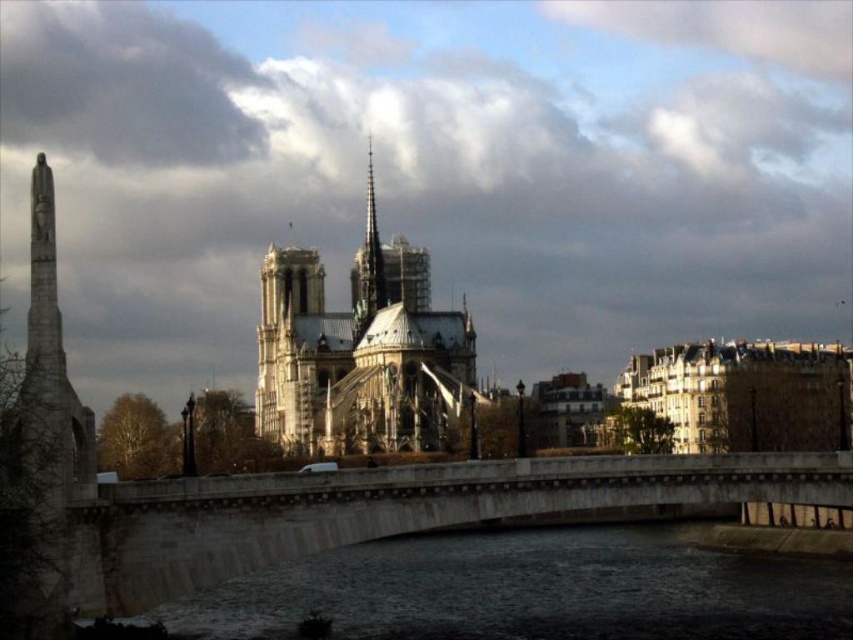
You are a tourist standing on the bridge and want to take a photo of the stone spire at center. According to the image coordinates, where should you aim your camera?

The stone spire at center is located at point (x=358, y=353), so you should aim your camera at those coordinates to capture it.